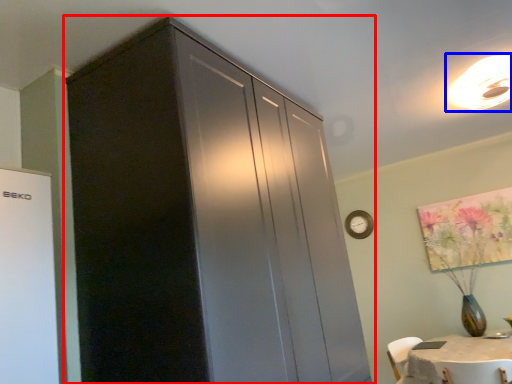
Question: Among these objects, which one is nearest to the camera, cupboard (highlighted by a red box) or light fixture (highlighted by a blue box)?

Choices:
 (A) cupboard
 (B) light fixture

Answer: (A)